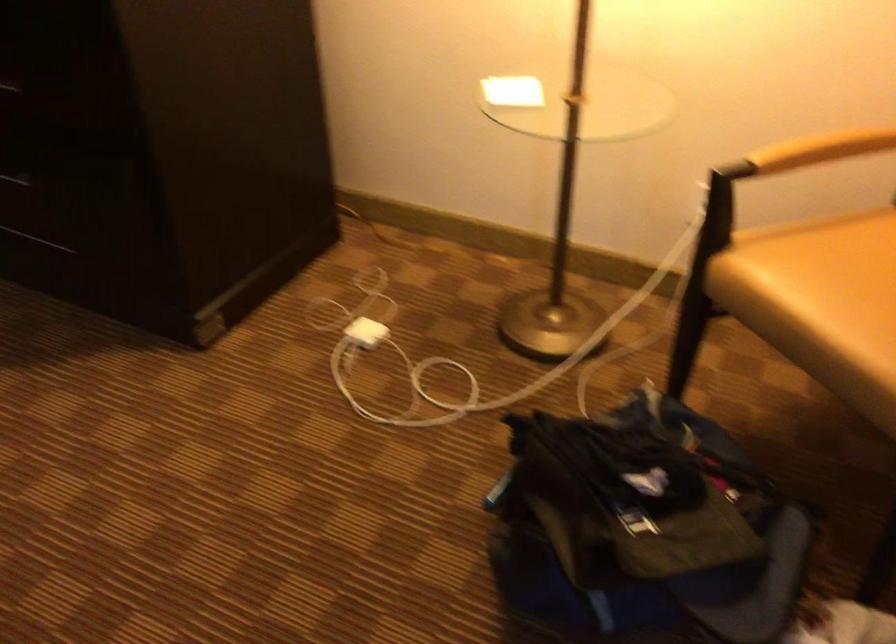
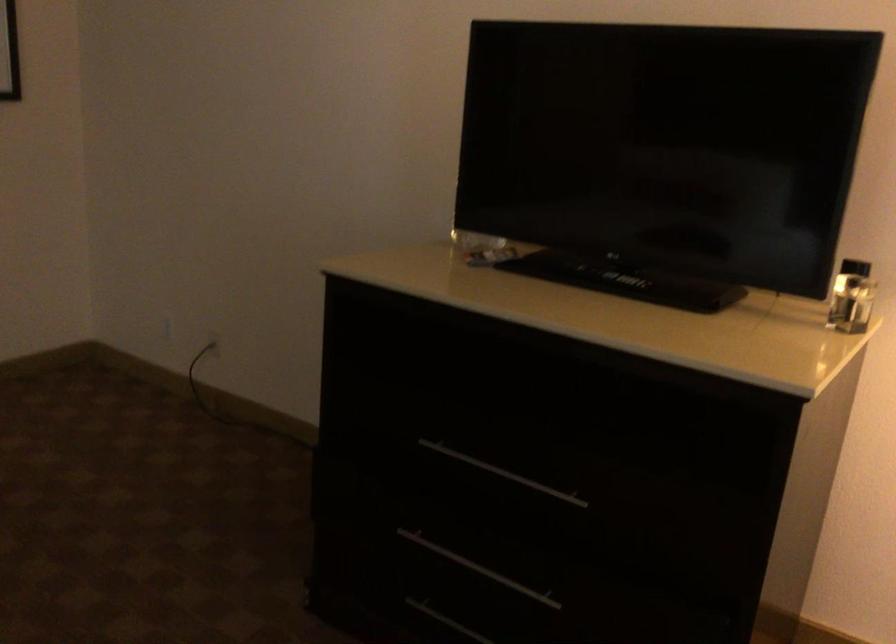
Question: How did the camera likely rotate?

Choices:
 (A) Left
 (B) Right
 (C) Up
 (D) Down

Answer: (C)